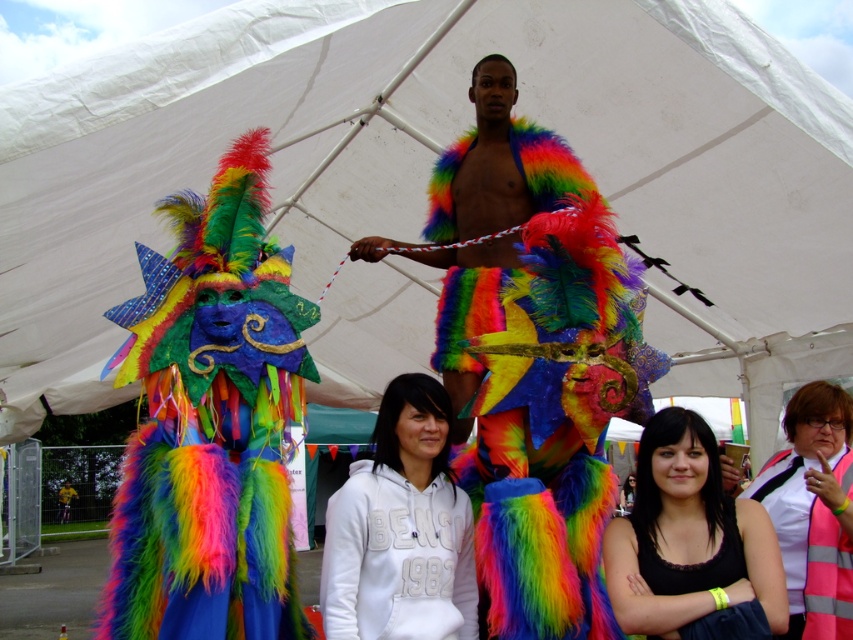
Question: Which is nearer to the multicolored furry costume at left?

Choices:
 (A) reflective silver vest at lower right
 (B) black matte shirt at lower center
 (C) black matte tank top at lower center
 (D) white fleece hoodie at center

Answer: (D)

Question: Is multicolored furry costume at left wider than reflective silver vest at lower right?

Choices:
 (A) yes
 (B) no

Answer: (A)

Question: Based on their relative distances, which object is nearer to the white fleece hoodie at center?

Choices:
 (A) multicolored furry costume at left
 (B) black matte shirt at lower center
 (C) rainbow fluffy costume at center

Answer: (A)

Question: Can you confirm if reflective silver vest at lower right is positioned to the right of black matte tank top at lower center?

Choices:
 (A) yes
 (B) no

Answer: (A)

Question: Estimate the real-world distances between objects in this image. Which object is closer to the reflective silver vest at lower right?

Choices:
 (A) white fleece hoodie at center
 (B) black matte shirt at lower center
 (C) rainbow fluffy costume at center
 (D) black matte tank top at lower center

Answer: (B)

Question: Is reflective silver vest at lower right to the right of black matte tank top at lower center from the viewer's perspective?

Choices:
 (A) no
 (B) yes

Answer: (B)